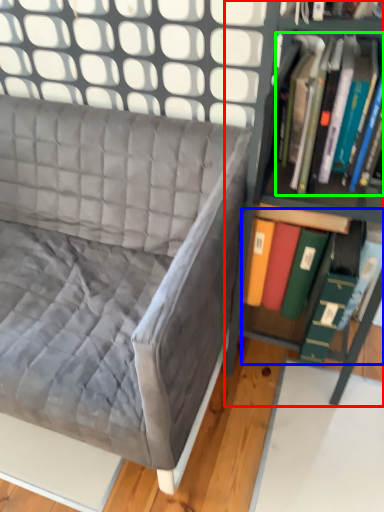
Question: Estimate the real-world distances between objects in this image. Which object is farther from shelf (highlighted by a red box), book (highlighted by a blue box) or book (highlighted by a green box)?

Choices:
 (A) book
 (B) book

Answer: (B)